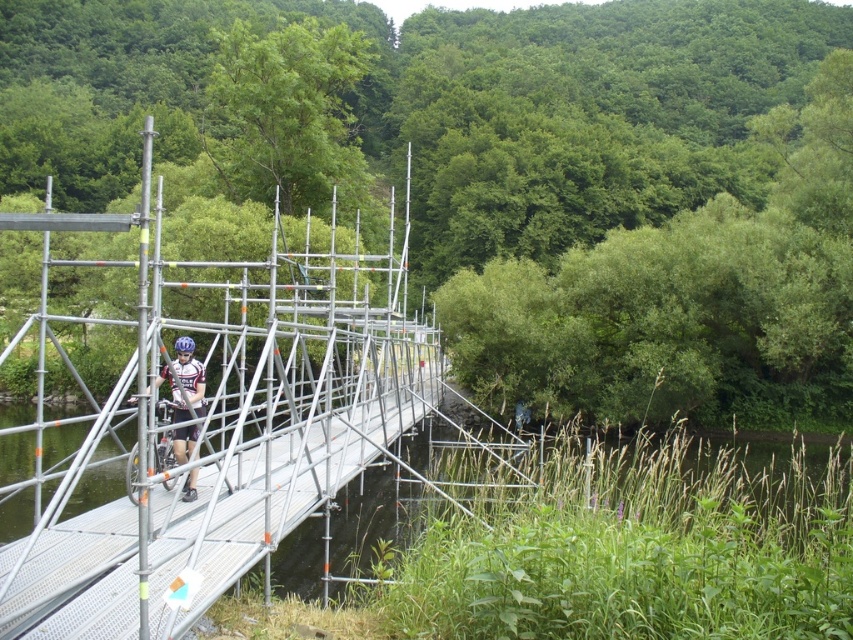
You are a cyclist trying to cross the metal scaffolding at center with your matte black bicycle at center. Based on the scene, can you safely ride your bicycle onto the scaffolding? Explain your reasoning.

The metal scaffolding at center is to the left of the matte black bicycle at center, which suggests that the bicycle is already positioned off the scaffolding. Since the person is carrying the bicycle while walking on the bridge, it implies that riding the bicycle directly onto the scaffolding may not be safe due to its structure or stability. Therefore, it might be safer to walk the bicycle across rather than ride it.